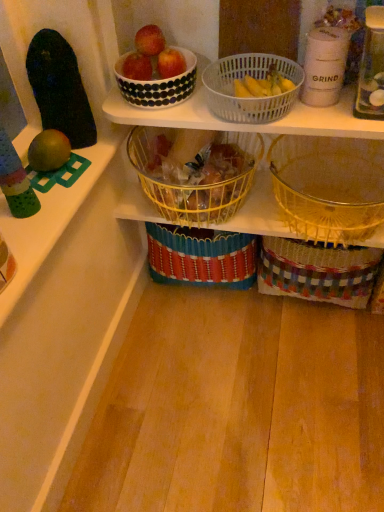
Question: Considering the positions of woven multicolored basket at lower right and shiny red apple at upper center, the 2th apple when ordered from right to left, in the image, is woven multicolored basket at lower right wider or thinner than shiny red apple at upper center, the 2th apple when ordered from right to left,?

Choices:
 (A) thin
 (B) wide

Answer: (B)

Question: Considering their positions, is woven multicolored basket at lower right located in front of or behind shiny red apple at upper center, the 2th apple when ordered from right to left?

Choices:
 (A) front
 (B) behind

Answer: (B)

Question: Estimate the real-world distances between objects in this image. Which object is closer to the shiny red apple at upper center, the second apple when ordered from left to right?

Choices:
 (A) white dotted bowl at upper center
 (B) yellow plastic bananas at upper center
 (C) transparent plastic bottle at upper right
 (D) matte black bowl at upper center, which appears as the 3th apple when viewed from the right
 (E) yellow wire basket at center, marked as the third basket in a right-to-left arrangement

Answer: (D)

Question: Which object is the farthest from the matte black bowl at upper center, which appears as the 3th apple when viewed from the right?

Choices:
 (A) yellow plastic bananas at upper center
 (B) yellow wire basket at center, positioned as the first basket in left-to-right order
 (C) translucent plastic basket at upper center, which appears as the second basket when viewed from the left
 (D) glossy apple at upper center, acting as the first apple starting from the right
 (E) yellow woven basket at lower right, arranged as the 3th basket when viewed from the left

Answer: (E)